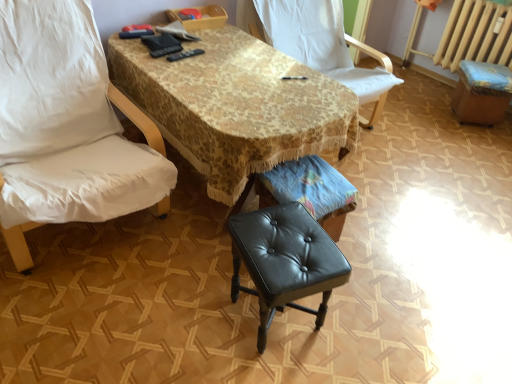
The width and height of the screenshot is (512, 384). I want to click on free space in front of gold lace tablecloth at center, so click(219, 318).